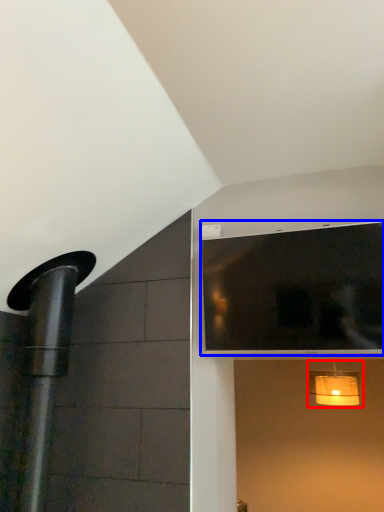
Question: Which object is further to the camera taking this photo, light fixture (highlighted by a red box) or window (highlighted by a blue box)?

Choices:
 (A) light fixture
 (B) window

Answer: (A)